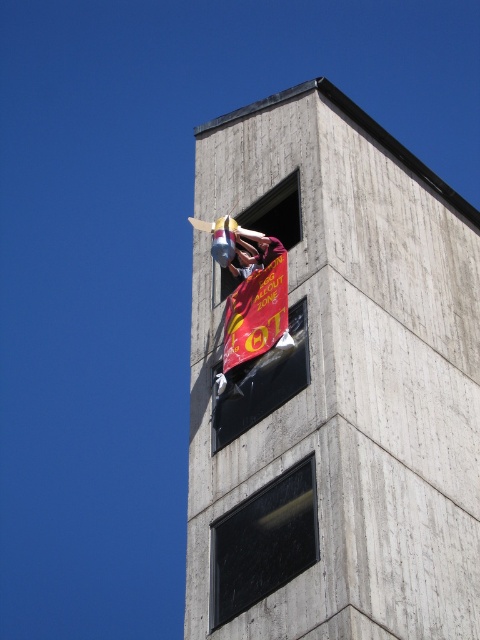
Who is more forward, (223,525) or (282,353)?

Point (223,525)

Is point (296, 536) closer to camera compared to point (218, 404)?

Yes, point (296, 536) is closer to viewer.

Locate an element on the screen. transparent glass window at lower center is located at coordinates (264, 541).